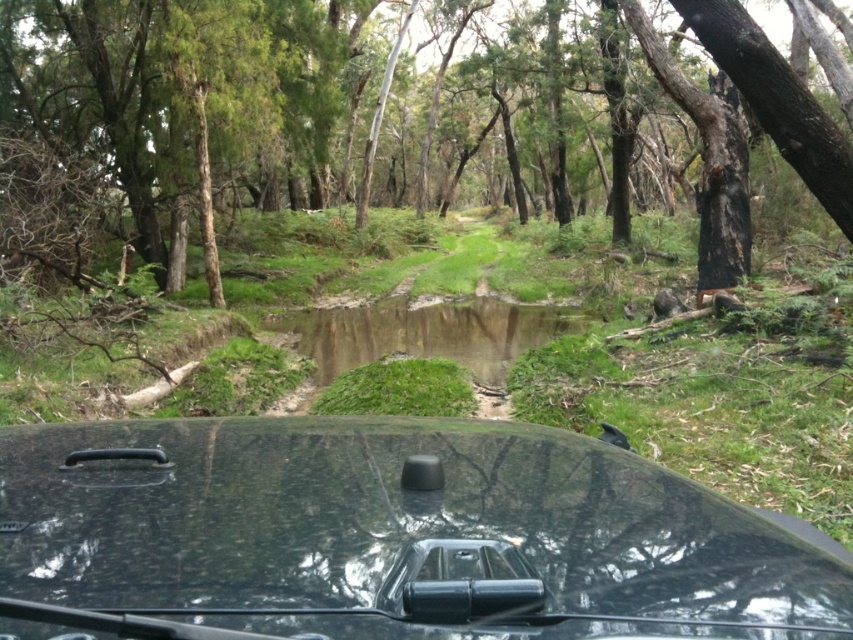
Question: Which object is positioned closest to the glossy black car at center?

Choices:
 (A) green grassy puddle at center
 (B) brown rough tree at center

Answer: (A)

Question: Can you confirm if brown rough tree at center is positioned above glossy black car at center?

Choices:
 (A) no
 (B) yes

Answer: (B)

Question: Is glossy black car at center thinner than green grassy puddle at center?

Choices:
 (A) no
 (B) yes

Answer: (A)

Question: Which is farther from the green grassy puddle at center?

Choices:
 (A) glossy black car at center
 (B) brown rough tree at center

Answer: (B)

Question: Which object is the farthest from the glossy black car at center?

Choices:
 (A) green grassy puddle at center
 (B) brown rough tree at center

Answer: (B)

Question: Does brown rough tree at center appear on the left side of green grassy puddle at center?

Choices:
 (A) no
 (B) yes

Answer: (A)